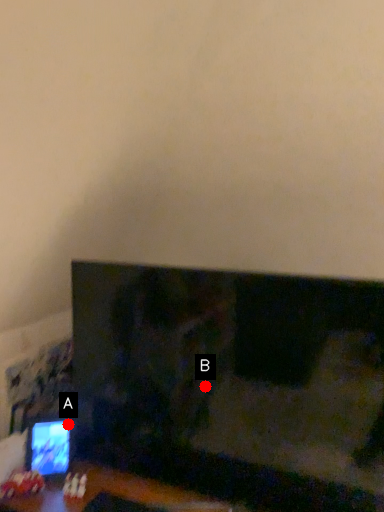
Question: Two points are circled on the image, labeled by A and B beside each circle. Which point appears farthest from the camera in this image?

Choices:
 (A) A is further
 (B) B is further

Answer: (A)